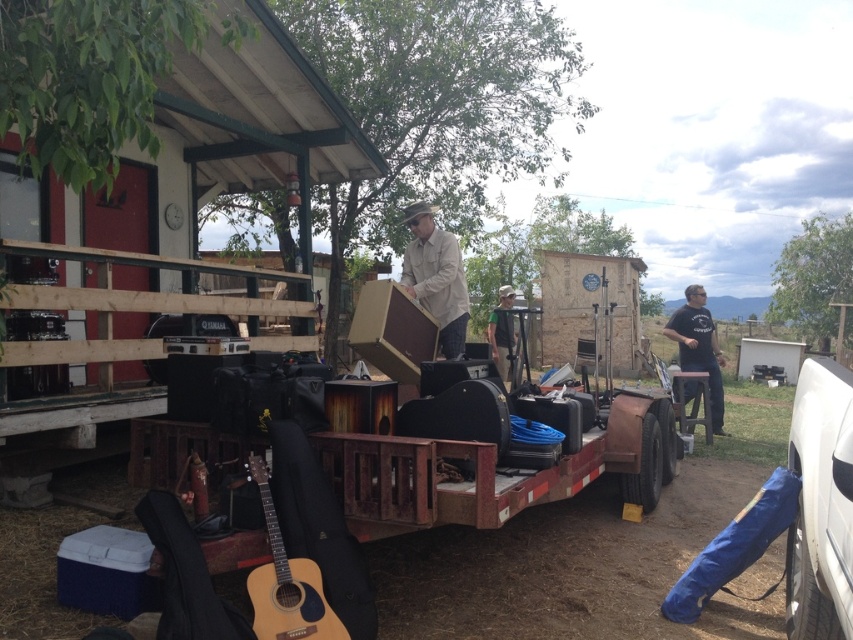
You are standing at the origin point of the image. A tan canvas guitar case at center is located at point (434, 276). If you move 0.1 units to the right, will you be closer to the tan canvas guitar case at center?

Moving 0.1 units to the right from the origin point would take you to position 0.1, 0.0. The tan canvas guitar case at center is at (434, 276). Since the distance between these two points is greater than 0.1 units, you would not be closer to the tan canvas guitar case at center.

You are a delivery person who needs to place a large package on the ground near the wooden hut at center and the tan canvas guitar case at center. However, you notice something about their positions. What issue might prevent you from placing the package between them?

→ The wooden hut at center is positioned over the tan canvas guitar case at center, meaning the guitar case is underneath the hut. This would make it impossible to place a package between them since the case is not on the ground in that area.

You are helping to organize items on the trailer. The wooden hut at center and the tan canvas guitar case at center are both on the trailer. Which one takes up more space?

The wooden hut at center has a larger size compared to the tan canvas guitar case at center, so it takes up more space.